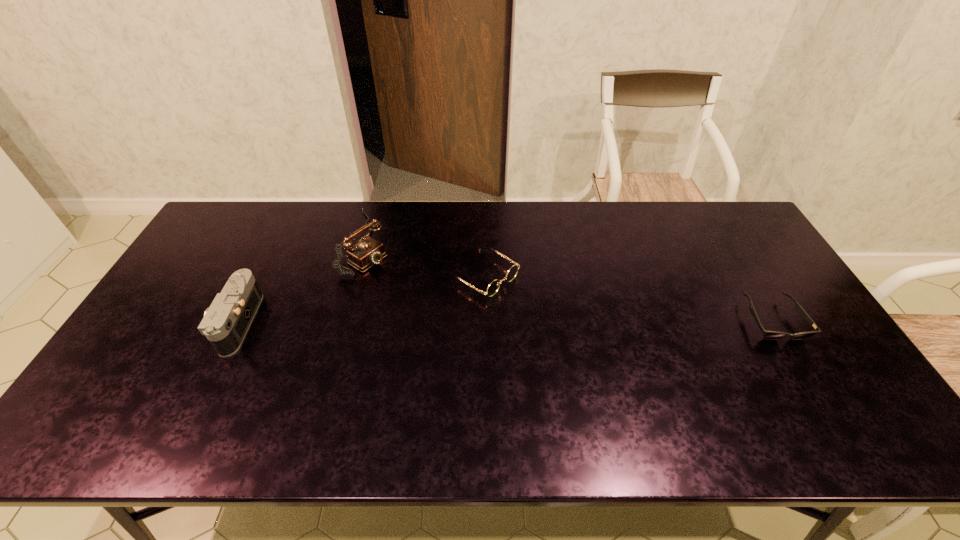
Locate an element on the screen. This screenshot has width=960, height=540. the second tallest object is located at coordinates (226, 322).

Locate an element on the screen. the leftmost object is located at coordinates (226, 322).

Find the location of a particular element. Image resolution: width=960 pixels, height=540 pixels. sunglasses is located at coordinates (769, 335).

Identify the location of the shortest object. This screenshot has height=540, width=960. (769, 335).

You are a GUI agent. You are given a task and a screenshot of the screen. Output one action in this format:
    pyautogui.click(x=<x>, y=<y>)
    Task: Click on the tallest object
    
    Given the screenshot: What is the action you would take?
    pyautogui.click(x=367, y=252)

You are a GUI agent. You are given a task and a screenshot of the screen. Output one action in this format:
    pyautogui.click(x=<x>, y=<y>)
    Task: Click on the third object from right to left
    The image size is (960, 540).
    Given the screenshot: What is the action you would take?
    pyautogui.click(x=367, y=252)

I want to click on spectacles, so click(x=494, y=286).

I want to click on the third tallest object, so click(494, 286).

Identify the location of free location located on the lens of the leftmost object. (172, 322).

What are the coordinates of `vacant area located 0.060m on the lens of the leftmost object` in the screenshot? It's located at (197, 322).